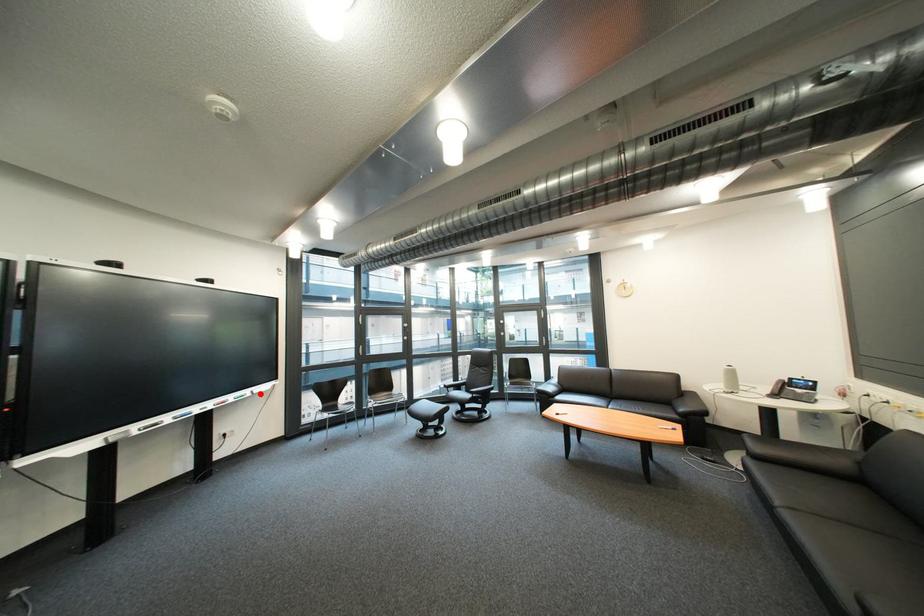
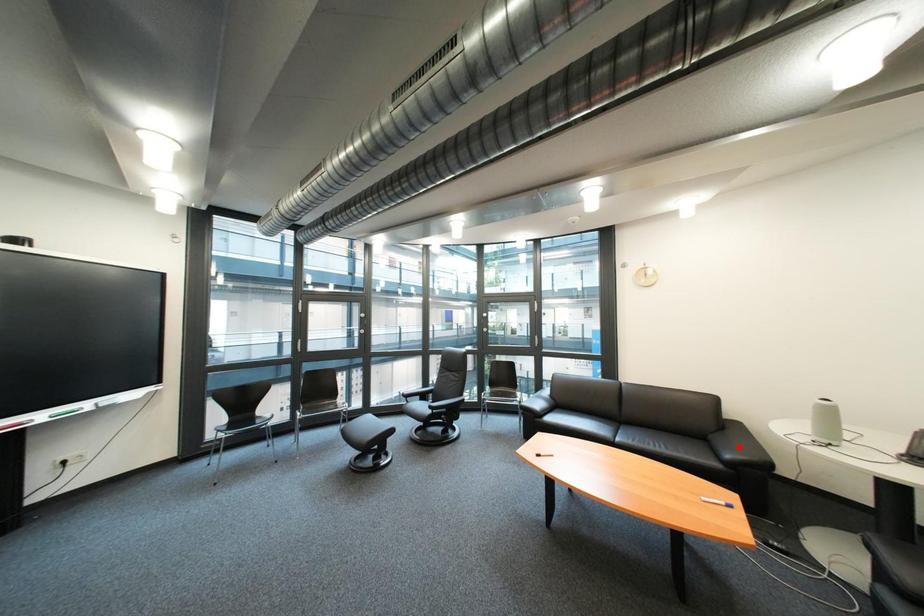
Looking at this image, I am providing you with two images of the same scene from different viewpoints. A red point is marked on the first image and another point is marked on the second image. Is the marked point in image1 the same physical position as the marked point in image2?

No